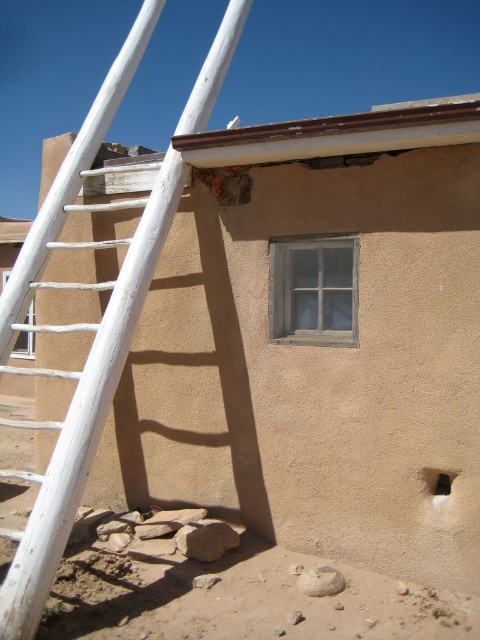
You are a contractor assessing the construction site. You notice the white wooden ladder at left and the black matte hole at lower right. Which object is taller?

The white wooden ladder at left is taller than the black matte hole at lower right according to the description.

You are a painter who needs to place a 1.2 meter wide canvas between the white wooden ladder at left and the wooden frame window at center. Can you fit it there?

The white wooden ladder at left might be wider than the wooden frame window at center. Since the ladder could be wider than the window, the total space between them may not be sufficient to fit a 1.2 meter wide canvas. You should measure the actual width before deciding.

You are standing in front of the adobe building and want to reach the wooden frame window at center to check its condition. The white wooden ladder at left is in your way. Can you move the ladder aside to access the window?

The white wooden ladder at left is closer to the viewer than the wooden frame window at center, so you can move the ladder aside to access the window.